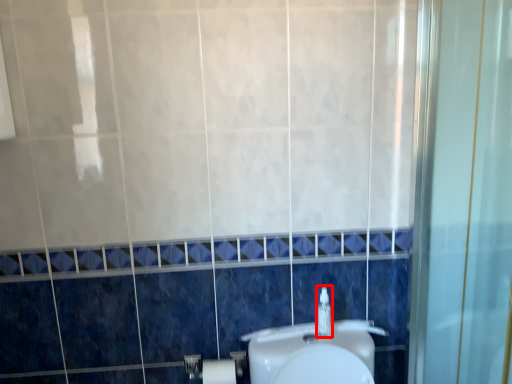
Question: Observing the image, what is the correct spatial positioning of soap dispenser (annotated by the red box) in reference to toilet paper?

Choices:
 (A) left
 (B) right

Answer: (B)